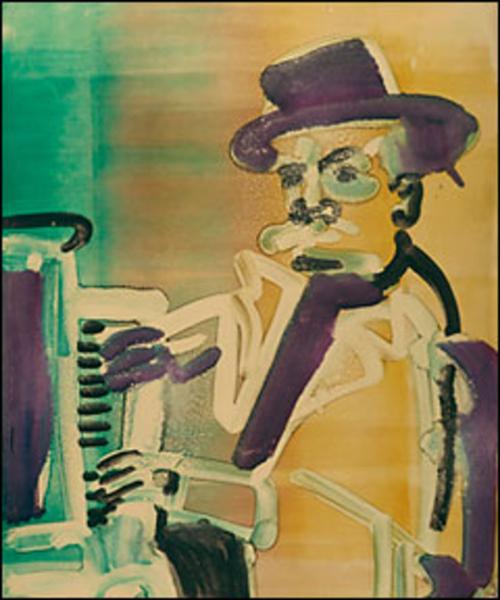
Identify the location of wall. This screenshot has height=600, width=500. (189, 119).